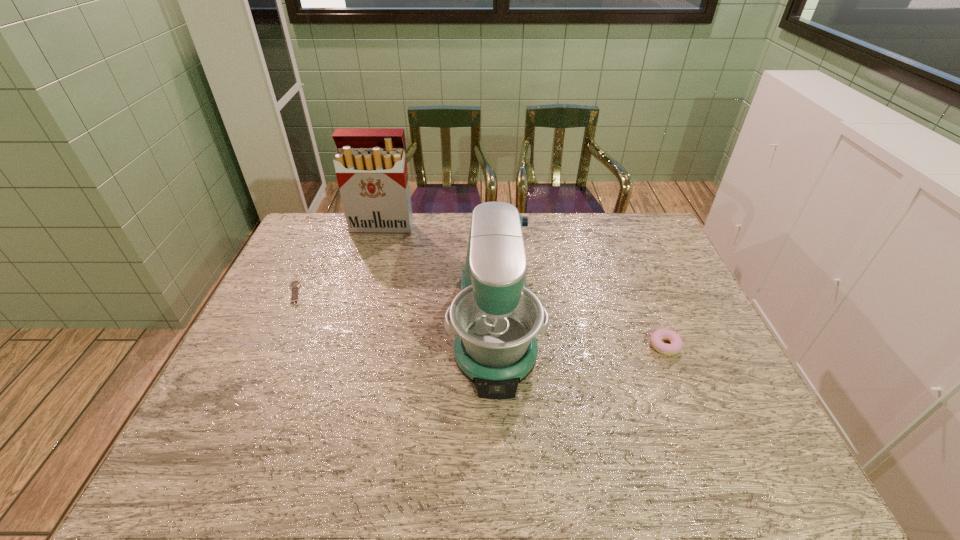
Identify the location of free space located on the left of the doughnut. (510, 346).

The height and width of the screenshot is (540, 960). I want to click on vacant space located 0.130m on the right of the leftmost object, so click(346, 294).

Where is `object present at the far edge`? The width and height of the screenshot is (960, 540). object present at the far edge is located at coordinates (371, 169).

Find the location of a particular element. The height and width of the screenshot is (540, 960). object that is at the left edge is located at coordinates (294, 285).

Where is `object at the right edge`? object at the right edge is located at coordinates (657, 336).

Find the location of a particular element. The height and width of the screenshot is (540, 960). vacant space at the far edge of the desktop is located at coordinates (424, 237).

Locate an element on the screen. This screenshot has width=960, height=540. vacant space at the near edge of the desktop is located at coordinates (454, 462).

What are the coordinates of `free space at the left edge of the desktop` in the screenshot? It's located at (244, 347).

Find the location of a particular element. The height and width of the screenshot is (540, 960). free space at the right edge of the desktop is located at coordinates (640, 262).

The image size is (960, 540). In the image, there is a desktop. In order to click on free space at the far right corner in this screenshot , I will do `click(618, 224)`.